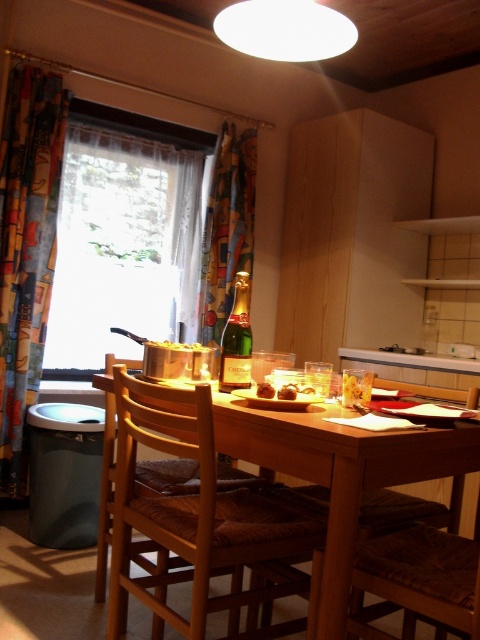
Question: Does wooden table at center have a lesser width compared to white glossy counter top at center?

Choices:
 (A) no
 (B) yes

Answer: (A)

Question: Which of the following is the farthest from the observer?

Choices:
 (A) multicolored fabric curtain at left
 (B) yellowish matte pot at center
 (C) brown chocolate truffle at table center
 (D) brown woven chair at lower right

Answer: (A)

Question: Can you confirm if brown woven chair at lower right is bigger than brown chocolate truffle at table center?

Choices:
 (A) no
 (B) yes

Answer: (B)

Question: Which point is farther to the camera?

Choices:
 (A) (230, 250)
 (B) (260, 388)

Answer: (A)

Question: Which object is closer to the camera taking this photo?

Choices:
 (A) brown crumbly pastry at table center
 (B) multicolored fabric curtain at center

Answer: (A)

Question: Does wooden table at center have a greater width compared to white glossy counter top at center?

Choices:
 (A) no
 (B) yes

Answer: (B)